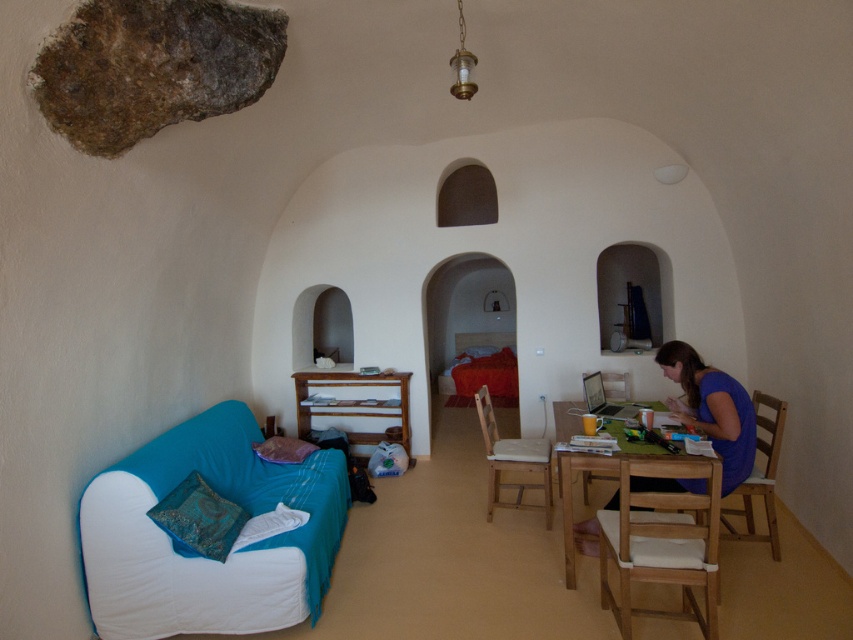
Does point (401, 416) come behind point (749, 529)?

Yes, point (401, 416) is behind point (749, 529).

Is wooden shelf at center taller than wooden chair at right?

Incorrect, wooden shelf at center's height is not larger of wooden chair at right's.

The height and width of the screenshot is (640, 853). Find the location of `wooden shelf at center`. wooden shelf at center is located at coordinates (355, 403).

Find the location of a particular element. This screenshot has height=640, width=853. wooden shelf at center is located at coordinates (355, 403).

Who is higher up, blue fabric shirt at lower right or wooden chair at center?

blue fabric shirt at lower right is above.

Between blue fabric shirt at lower right and wooden chair at center, which one is positioned lower?

Positioned lower is wooden chair at center.

Image resolution: width=853 pixels, height=640 pixels. In order to click on blue fabric shirt at lower right in this screenshot , I will do `click(712, 410)`.

Who is positioned more to the left, teal brocade pillow at lower left or wooden chair at center?

teal brocade pillow at lower left is more to the left.

Does teal brocade pillow at lower left have a lesser width compared to wooden chair at center?

Yes, teal brocade pillow at lower left is thinner than wooden chair at center.

Measure the distance between teal brocade pillow at lower left and camera.

teal brocade pillow at lower left and camera are 8.42 feet apart.

At what (x,y) coordinates should I click in order to perform the action: click on teal brocade pillow at lower left. Please return your answer as a coordinate pair (x, y). This screenshot has height=640, width=853. Looking at the image, I should click on (199, 516).